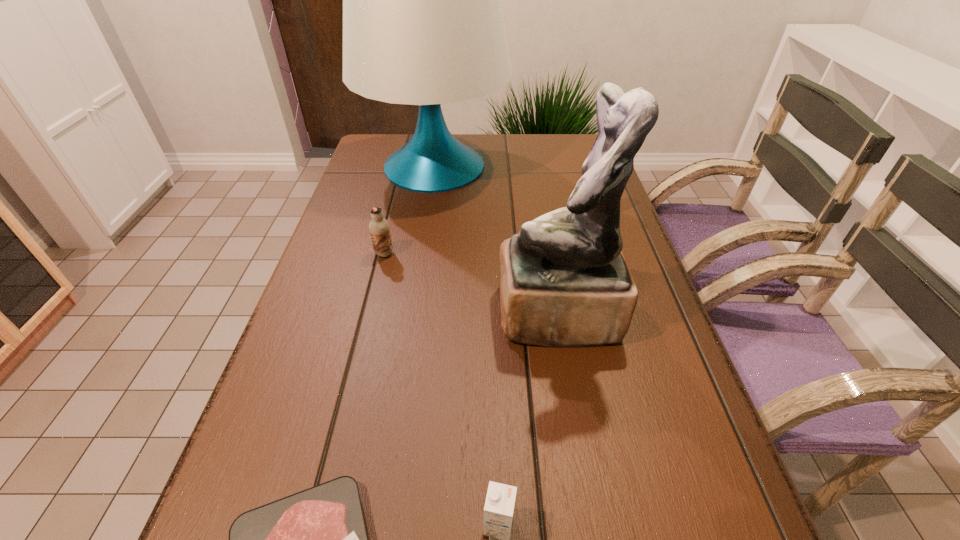
You are a GUI agent. You are given a task and a screenshot of the screen. Output one action in this format:
    pyautogui.click(x=<x>, y=<y>)
    Task: Click on the vacant position located 0.190m on the back of the taller chocolate milk
    Image resolution: width=960 pixels, height=540 pixels.
    Given the screenshot: What is the action you would take?
    pyautogui.click(x=396, y=204)

The height and width of the screenshot is (540, 960). I want to click on object that is at the far edge, so click(423, 24).

The image size is (960, 540). I want to click on table lamp that is at the left edge, so pyautogui.click(x=423, y=24).

Where is `chocolate milk situated at the left edge`? chocolate milk situated at the left edge is located at coordinates (379, 228).

Where is `object at the right edge`? object at the right edge is located at coordinates (564, 282).

Identify the location of object that is at the far left corner. Image resolution: width=960 pixels, height=540 pixels. (423, 24).

Locate an element on the screen. Image resolution: width=960 pixels, height=540 pixels. vacant space at the far edge of the desktop is located at coordinates (495, 147).

This screenshot has width=960, height=540. What are the coordinates of `vacant space at the left edge of the desktop` in the screenshot? It's located at (294, 414).

Image resolution: width=960 pixels, height=540 pixels. In order to click on free space at the right edge in this screenshot , I will do `click(658, 313)`.

The height and width of the screenshot is (540, 960). In the image, there is a desktop. In order to click on free space at the far left corner in this screenshot , I will do `click(370, 136)`.